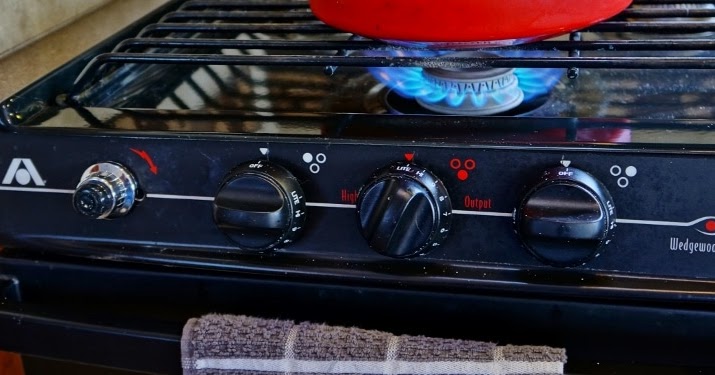
Find the location of `white stripe on dishtowel`. white stripe on dishtowel is located at coordinates (399, 366), (290, 342), (392, 347), (497, 351).